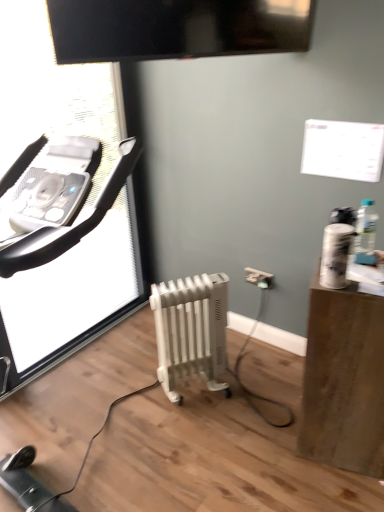
The height and width of the screenshot is (512, 384). I want to click on vacant area that lies to the right of white plastic radiator at center, so click(x=249, y=391).